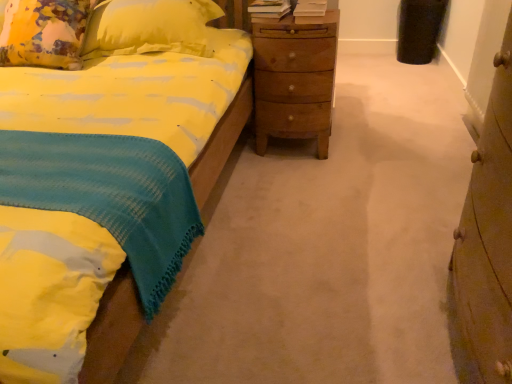
Question: Do you think yellow fabric pillow at upper left is within wooden nightstand at center, or outside of it?

Choices:
 (A) inside
 (B) outside

Answer: (B)

Question: From a real-world perspective, is yellow fabric pillow at upper left physically located above or below wooden nightstand at center?

Choices:
 (A) below
 (B) above

Answer: (B)

Question: Estimate the real-world distances between objects in this image. Which object is closer to the wooden chest of drawers at right?

Choices:
 (A) yellow fabric pillow at upper left
 (B) wooden nightstand at center

Answer: (B)

Question: Which object is positioned closest to the wooden nightstand at center?

Choices:
 (A) wooden chest of drawers at right
 (B) yellow fabric pillow at upper left

Answer: (B)